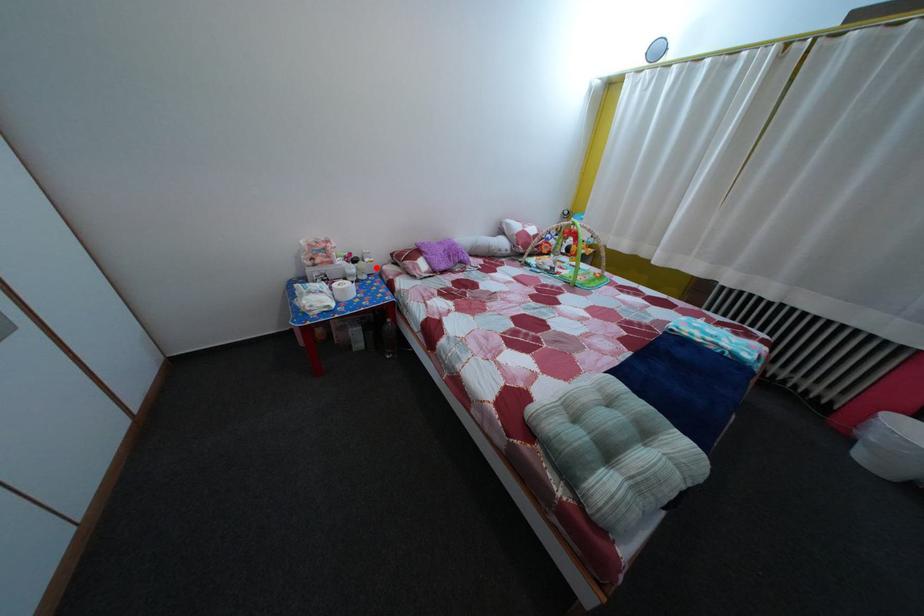
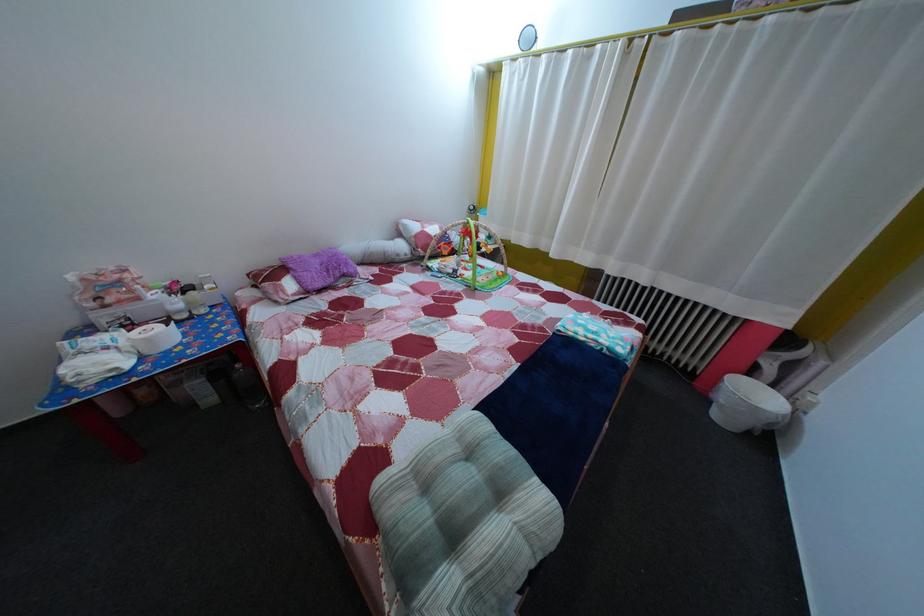
Locate, in the second image, the point that corresponds to the highlighted location in the first image.

(216, 294)